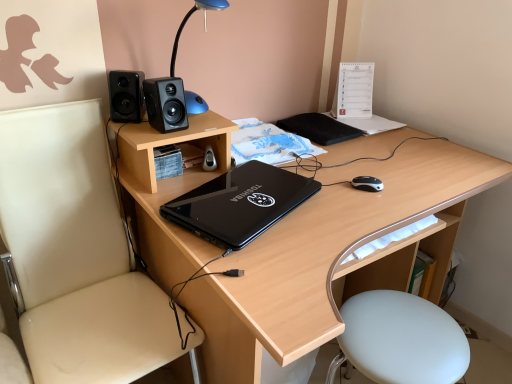
This screenshot has height=384, width=512. I want to click on free region under blue glossy table lamp at upper center (from a real-world perspective), so click(207, 120).